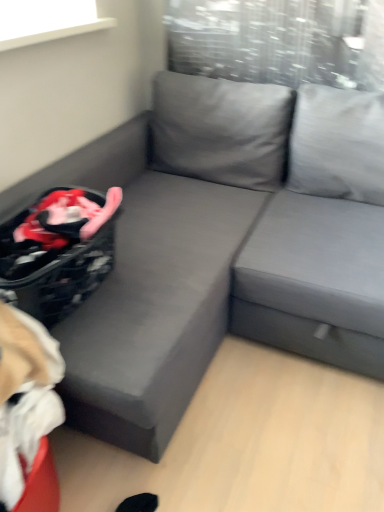
Question: From the image's perspective, is black textured laundry basket at lower left over beige fabric bean bag chair at lower left?

Choices:
 (A) yes
 (B) no

Answer: (A)

Question: From a real-world perspective, is black textured laundry basket at lower left positioned over beige fabric bean bag chair at lower left based on gravity?

Choices:
 (A) yes
 (B) no

Answer: (A)

Question: Is the depth of black textured laundry basket at lower left greater than that of beige fabric bean bag chair at lower left?

Choices:
 (A) no
 (B) yes

Answer: (B)

Question: Does black textured laundry basket at lower left appear on the left side of beige fabric bean bag chair at lower left?

Choices:
 (A) yes
 (B) no

Answer: (B)

Question: Is black textured laundry basket at lower left to the right of beige fabric bean bag chair at lower left from the viewer's perspective?

Choices:
 (A) no
 (B) yes

Answer: (B)

Question: Is black textured laundry basket at lower left not inside beige fabric bean bag chair at lower left?

Choices:
 (A) no
 (B) yes

Answer: (B)

Question: From the image's perspective, is black textured laundry basket at lower left located beneath gray fabric couch at center?

Choices:
 (A) no
 (B) yes

Answer: (B)

Question: Is black textured laundry basket at lower left not close to gray fabric couch at center?

Choices:
 (A) yes
 (B) no

Answer: (B)

Question: Is black textured laundry basket at lower left taller than gray fabric couch at center?

Choices:
 (A) yes
 (B) no

Answer: (B)

Question: From the image's perspective, is black textured laundry basket at lower left above gray fabric couch at center?

Choices:
 (A) yes
 (B) no

Answer: (B)

Question: Can you confirm if black textured laundry basket at lower left is positioned to the left of gray fabric couch at center?

Choices:
 (A) yes
 (B) no

Answer: (A)

Question: Considering the relative sizes of black textured laundry basket at lower left and gray fabric couch at center in the image provided, is black textured laundry basket at lower left smaller than gray fabric couch at center?

Choices:
 (A) yes
 (B) no

Answer: (A)

Question: From the image's perspective, is beige fabric bean bag chair at lower left on gray fabric couch at center?

Choices:
 (A) no
 (B) yes

Answer: (A)